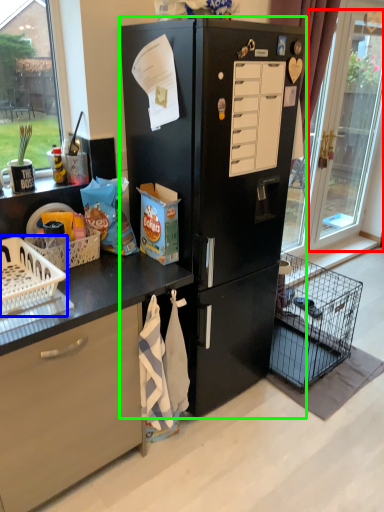
Question: Which object is positioned closest to glass door (highlighted by a red box)? Select from basket (highlighted by a blue box) and refrigerator (highlighted by a green box).

Choices:
 (A) basket
 (B) refrigerator

Answer: (B)